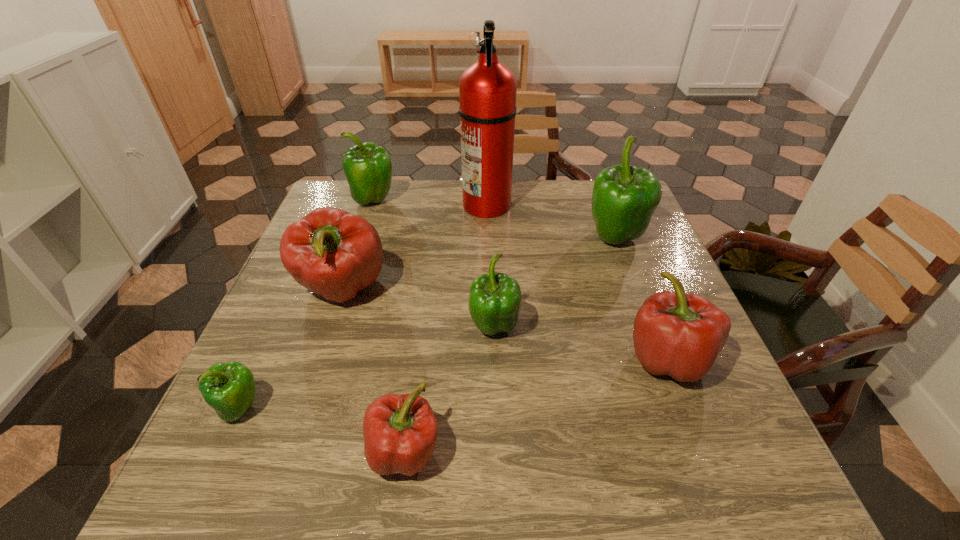
The height and width of the screenshot is (540, 960). I want to click on pink bell pepper that is the closest to the farthest bell pepper, so coord(333,253).

The image size is (960, 540). I want to click on free space that satisfies the following two spatial constraints: 1. at the nozzle of the fire extinguisher; 2. on the front side of the biggest pink bell pepper, so click(489, 289).

Find the location of a particular element. This screenshot has width=960, height=540. free space that satisfies the following two spatial constraints: 1. at the nozzle of the second nearest pink bell pepper; 2. on the left side of the fire extinguisher is located at coordinates (490, 357).

The image size is (960, 540). I want to click on vacant space that satisfies the following two spatial constraints: 1. on the back side of the farthest pink bell pepper; 2. on the left side of the third smallest green bell pepper, so click(x=372, y=200).

Where is `vacant position in the image that satisfies the following two spatial constraints: 1. at the nozzle of the second nearest green bell pepper; 2. on the right side of the fire extinguisher`? Image resolution: width=960 pixels, height=540 pixels. vacant position in the image that satisfies the following two spatial constraints: 1. at the nozzle of the second nearest green bell pepper; 2. on the right side of the fire extinguisher is located at coordinates (490, 328).